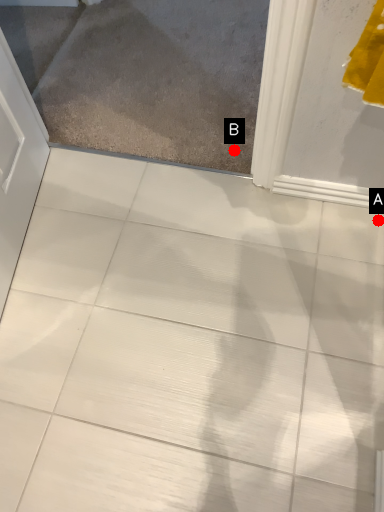
Question: Two points are circled on the image, labeled by A and B beside each circle. Which of the following is the farthest from the observer?

Choices:
 (A) A is further
 (B) B is further

Answer: (B)